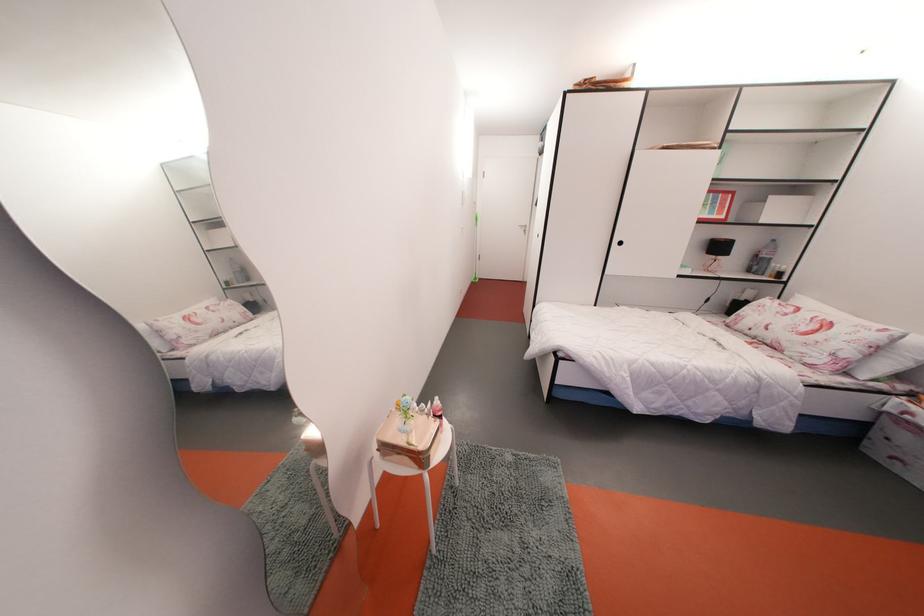
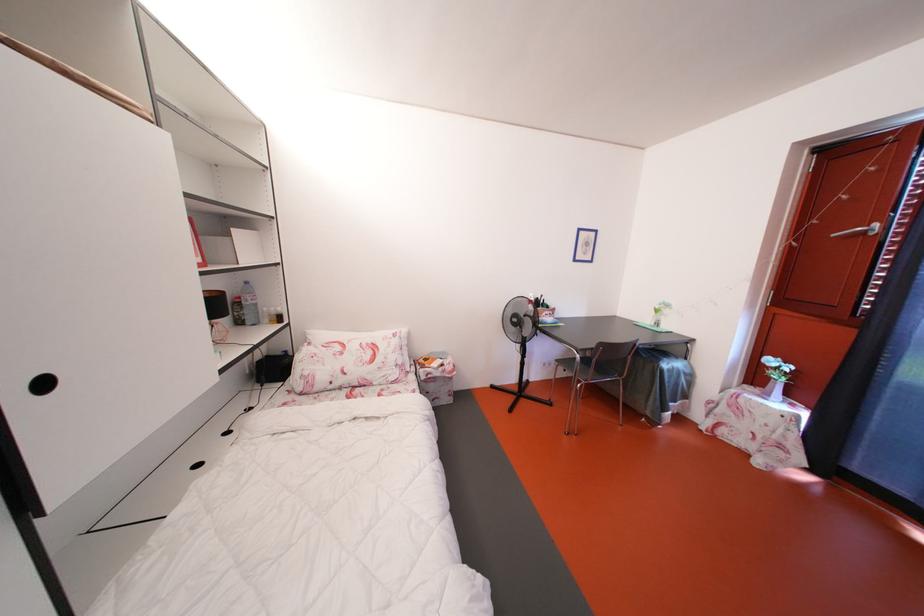
The point at (781, 246) is marked in the first image. Where is the corresponding point in the second image?

(253, 288)